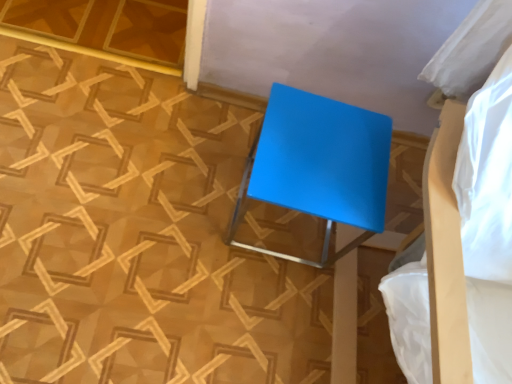
Where is `free space in front of blue glossy stool at center`? The height and width of the screenshot is (384, 512). free space in front of blue glossy stool at center is located at coordinates (248, 295).